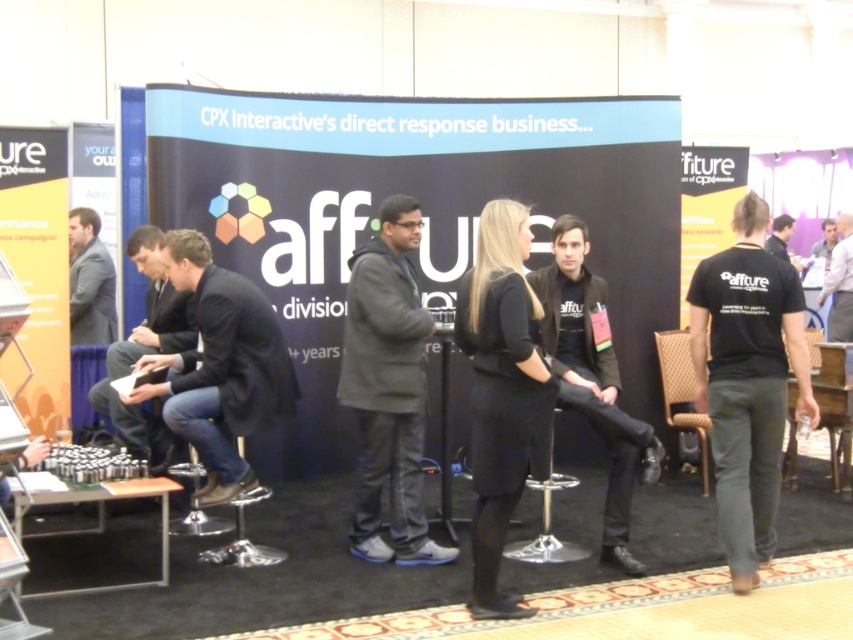
Question: From the image, what is the correct spatial relationship of black matte jacket at center in relation to white shirt at upper right?

Choices:
 (A) right
 (B) left

Answer: (B)

Question: Which object is positioned closest to the gray suit jacket at left?

Choices:
 (A) light blue shirt at upper right
 (B) black leather jacket at center

Answer: (B)

Question: Which of the following is the closest to the observer?

Choices:
 (A) (695, 280)
 (B) (653, 444)

Answer: (A)

Question: From the image, what is the correct spatial relationship of dark gray hoodie at center in relation to gray suit jacket at left?

Choices:
 (A) above
 (B) below

Answer: (B)

Question: Can you confirm if dark gray hoodie at center is positioned below black leather jacket at center?

Choices:
 (A) no
 (B) yes

Answer: (B)

Question: Which of the following is the farthest from the observer?

Choices:
 (A) (811, 250)
 (B) (408, 515)

Answer: (A)